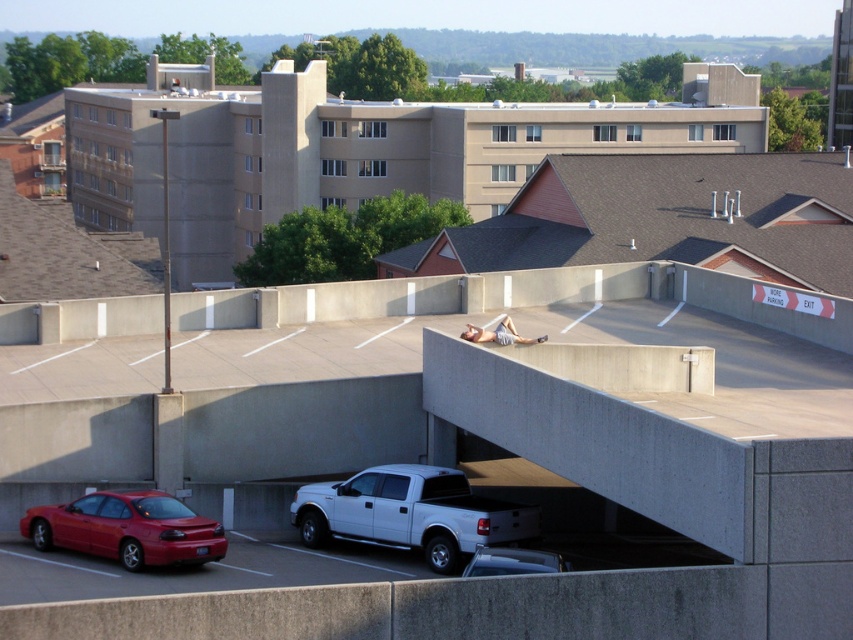
Question: Is white matte pickup truck at center smaller than shiny red sedan at lower left?

Choices:
 (A) no
 (B) yes

Answer: (A)

Question: Among these objects, which one is nearest to the camera?

Choices:
 (A) metallic silver truck at lower center
 (B) concrete parking garage at upper center
 (C) shiny red sedan at lower left
 (D) concrete at upper center

Answer: (D)

Question: Does concrete at upper center have a larger size compared to metallic silver truck at lower center?

Choices:
 (A) yes
 (B) no

Answer: (A)

Question: Which object is the closest to the concrete parking garage at upper center?

Choices:
 (A) white matte pickup truck at center
 (B) concrete at upper center

Answer: (A)

Question: Which of these objects is positioned closest to the metallic silver truck at lower center?

Choices:
 (A) concrete parking garage at upper center
 (B) white matte pickup truck at center

Answer: (B)

Question: Is concrete parking garage at upper center behind white matte pickup truck at center?

Choices:
 (A) yes
 (B) no

Answer: (A)